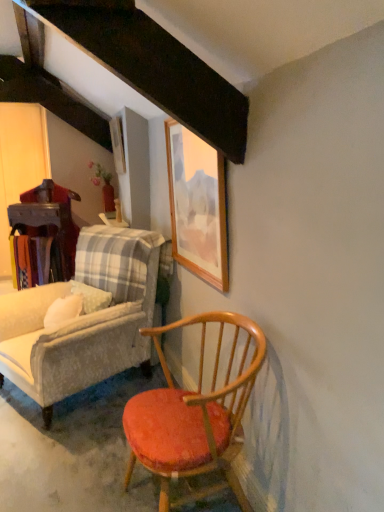
I want to click on wooden picture frame at upper center, which appears as the 1th picture frame when viewed from the right, so click(x=197, y=205).

In order to click on wooden chair with cushion at lower left, the second chair viewed from the right in this screenshot , I will do `click(83, 319)`.

Describe the element at coordinates (41, 218) in the screenshot. I see `wooden table at left` at that location.

The height and width of the screenshot is (512, 384). Describe the element at coordinates (117, 144) in the screenshot. I see `wooden picture frame at upper center, positioned as the 2th picture frame in bottom-to-top order` at that location.

The height and width of the screenshot is (512, 384). What are the coordinates of `wooden chair with orange cushion at lower right, the second chair positioned from the left` in the screenshot? It's located at (194, 415).

How much space does wooden chair with orange cushion at lower right, arranged as the first chair when viewed from the right, occupy vertically?

30.11 inches.

Locate an element on the screen. The image size is (384, 512). wooden picture frame at upper center, which appears as the 1th picture frame when viewed from the right is located at coordinates (197, 205).

How distant is wooden chair with cushion at lower left, the first chair in the back-to-front sequence, from wooden picture frame at upper center, positioned as the 2th picture frame in bottom-to-top order?

wooden chair with cushion at lower left, the first chair in the back-to-front sequence, and wooden picture frame at upper center, positioned as the 2th picture frame in bottom-to-top order, are 4.34 feet apart from each other.

Considering the sizes of objects wooden chair with cushion at lower left, the second chair viewed from the right, and wooden picture frame at upper center, arranged as the first picture frame when viewed from the top, in the image provided, who is bigger, wooden chair with cushion at lower left, the second chair viewed from the right, or wooden picture frame at upper center, arranged as the first picture frame when viewed from the top,?

A: wooden chair with cushion at lower left, the second chair viewed from the right, is bigger.

Would you say wooden chair with cushion at lower left, the second chair viewed from the right, contains wooden picture frame at upper center, arranged as the first picture frame when viewed from the top?

Definitely not — wooden picture frame at upper center, arranged as the first picture frame when viewed from the top, is not inside wooden chair with cushion at lower left, the second chair viewed from the right.

Which is in front, point (186, 229) or point (149, 260)?

The point (186, 229) is in front.

From the image's perspective, is wooden picture frame at upper center, the second picture frame positioned from the left, positioned above or below wooden chair with cushion at lower left, the second chair viewed from the right?

Based on their image positions, wooden picture frame at upper center, the second picture frame positioned from the left, is located above wooden chair with cushion at lower left, the second chair viewed from the right.

Is wooden picture frame at upper center, which is counted as the second picture frame, starting from the top, facing towards wooden chair with cushion at lower left, placed as the second chair when sorted from front to back?

No, wooden picture frame at upper center, which is counted as the second picture frame, starting from the top, is not oriented towards wooden chair with cushion at lower left, placed as the second chair when sorted from front to back.

Considering the relative sizes of wooden picture frame at upper center, which appears as the 2th picture frame when viewed from the right, and wooden chair with orange cushion at lower right, the second chair positioned from the left, in the image provided, is wooden picture frame at upper center, which appears as the 2th picture frame when viewed from the right, shorter than wooden chair with orange cushion at lower right, the second chair positioned from the left,?

Yes, wooden picture frame at upper center, which appears as the 2th picture frame when viewed from the right, is shorter than wooden chair with orange cushion at lower right, the second chair positioned from the left.

Can you tell me how much wooden picture frame at upper center, which ranks as the first picture frame in back-to-front order, and wooden chair with orange cushion at lower right, arranged as the first chair when viewed from the front, differ in facing direction?

0.000812 degrees separate the facing orientations of wooden picture frame at upper center, which ranks as the first picture frame in back-to-front order, and wooden chair with orange cushion at lower right, arranged as the first chair when viewed from the front.

Choose the correct answer: Is wooden picture frame at upper center, which ranks as the first picture frame in back-to-front order, inside wooden chair with orange cushion at lower right, the second chair from the back, or outside it?

wooden picture frame at upper center, which ranks as the first picture frame in back-to-front order, is not enclosed by wooden chair with orange cushion at lower right, the second chair from the back.

Considering the relative sizes of wooden picture frame at upper center, arranged as the first picture frame when viewed from the top, and wooden chair with orange cushion at lower right, arranged as the first chair when viewed from the front, in the image provided, is wooden picture frame at upper center, arranged as the first picture frame when viewed from the top, bigger than wooden chair with orange cushion at lower right, arranged as the first chair when viewed from the front,?

No.

Is wooden chair with orange cushion at lower right, arranged as the first chair when viewed from the right, at the right side of wooden picture frame at upper center, which ranks as the first picture frame in back-to-front order?

Correct, you'll find wooden chair with orange cushion at lower right, arranged as the first chair when viewed from the right, to the right of wooden picture frame at upper center, which ranks as the first picture frame in back-to-front order.

Which picture frame is the 2nd one when counting from the back of the wooden chair with orange cushion at lower right, the second chair positioned from the left? Please provide its 2D coordinates.

[(117, 144)]

Can you tell me how much wooden chair with orange cushion at lower right, arranged as the first chair when viewed from the right, and wooden picture frame at upper center, arranged as the first picture frame when viewed from the top, differ in facing direction?

They differ by 0.000812 degrees in their facing directions.

From the image's perspective, which one is positioned higher, wooden chair with orange cushion at lower right, the second chair positioned from the left, or wooden picture frame at upper center, arranged as the first picture frame when viewed from the top?

wooden picture frame at upper center, arranged as the first picture frame when viewed from the top, from the image's perspective.

From a real-world perspective, is wooden picture frame at upper center, positioned as the 2th picture frame in bottom-to-top order, located higher than wooden picture frame at upper center, the second picture frame positioned from the left?

Indeed, from a real-world perspective, wooden picture frame at upper center, positioned as the 2th picture frame in bottom-to-top order, stands above wooden picture frame at upper center, the second picture frame positioned from the left.

Is wooden picture frame at upper center, acting as the 2th picture frame starting from the front, inside or outside of wooden picture frame at upper center, which appears as the 1th picture frame when viewed from the right?

wooden picture frame at upper center, acting as the 2th picture frame starting from the front, exists outside the volume of wooden picture frame at upper center, which appears as the 1th picture frame when viewed from the right.

Is wooden picture frame at upper center, marked as the first picture frame in a left-to-right arrangement, smaller than wooden picture frame at upper center, which is the 1th picture frame in bottom-to-top order?

Indeed, wooden picture frame at upper center, marked as the first picture frame in a left-to-right arrangement, has a smaller size compared to wooden picture frame at upper center, which is the 1th picture frame in bottom-to-top order.

Is wooden picture frame at upper center, the second picture frame positioned from the left, not inside wooden chair with orange cushion at lower right, arranged as the first chair when viewed from the front?

Indeed, wooden picture frame at upper center, the second picture frame positioned from the left, is completely outside wooden chair with orange cushion at lower right, arranged as the first chair when viewed from the front.

Considering the sizes of wooden picture frame at upper center, which is counted as the second picture frame, starting from the top, and wooden chair with orange cushion at lower right, the second chair from the back, in the image, is wooden picture frame at upper center, which is counted as the second picture frame, starting from the top, taller or shorter than wooden chair with orange cushion at lower right, the second chair from the back,?

wooden picture frame at upper center, which is counted as the second picture frame, starting from the top, is taller than wooden chair with orange cushion at lower right, the second chair from the back.

Do you think wooden chair with orange cushion at lower right, arranged as the first chair when viewed from the front, is within wooden picture frame at upper center, which ranks as the 2th picture frame in back-to-front order, or outside of it?

The correct answer is: outside.

How far apart are wooden chair with orange cushion at lower right, arranged as the first chair when viewed from the right, and wooden picture frame at upper center, which is the 1th picture frame in bottom-to-top order?

They are 23.62 inches apart.

Which is farther, (178, 418) or (189, 162)?

The point (189, 162) is behind.

Which object is closer to the camera taking this photo, wooden chair with orange cushion at lower right, the second chair from the back, or wooden picture frame at upper center, the second picture frame positioned from the left?

Positioned in front is wooden chair with orange cushion at lower right, the second chair from the back.

The height and width of the screenshot is (512, 384). I want to click on chair that is the 1st one below the wooden picture frame at upper center, arranged as the first picture frame when viewed from the top (from a real-world perspective), so click(83, 319).

From the image's perspective, which chair is the 1st one below the wooden picture frame at upper center, which is the 1th picture frame in bottom-to-top order? Please provide its 2D coordinates.

[(83, 319)]

When comparing their distances from wooden table at left, does wooden picture frame at upper center, which appears as the 1th picture frame when viewed from the right, or wooden chair with cushion at lower left, the 1th chair in the left-to-right sequence, seem closer?

wooden chair with cushion at lower left, the 1th chair in the left-to-right sequence, is closer to wooden table at left.

Considering their positions, is wooden picture frame at upper center, acting as the 2th picture frame starting from the front, positioned further to wooden picture frame at upper center, which is counted as the second picture frame, starting from the top, than wooden table at left?

Based on the image, wooden table at left appears to be further to wooden picture frame at upper center, which is counted as the second picture frame, starting from the top.

Considering their positions, is wooden picture frame at upper center, the second picture frame positioned from the left, positioned closer to wooden table at left than wooden chair with orange cushion at lower right, the second chair positioned from the left?

wooden picture frame at upper center, the second picture frame positioned from the left, is positioned closer to the anchor wooden table at left.

When comparing their distances from wooden chair with orange cushion at lower right, arranged as the first chair when viewed from the right, does wooden table at left or wooden picture frame at upper center, the first picture frame positioned from the front, seem closer?

Based on the image, wooden picture frame at upper center, the first picture frame positioned from the front, appears to be nearer to wooden chair with orange cushion at lower right, arranged as the first chair when viewed from the right.

Estimate the real-world distances between objects in this image. Which object is closer to wooden picture frame at upper center, arranged as the first picture frame when viewed from the top, wooden chair with cushion at lower left, the first chair in the back-to-front sequence, or wooden table at left?

Based on the image, wooden table at left appears to be nearer to wooden picture frame at upper center, arranged as the first picture frame when viewed from the top.

From the image, which object appears to be farther from wooden picture frame at upper center, the first picture frame positioned from the front, wooden chair with orange cushion at lower right, the second chair positioned from the left, or wooden table at left?

wooden table at left is further to wooden picture frame at upper center, the first picture frame positioned from the front.

Which object lies further to the anchor point wooden chair with cushion at lower left, the 1th chair in the left-to-right sequence, wooden picture frame at upper center, positioned as the 2th picture frame in bottom-to-top order, or wooden table at left?

The object further to wooden chair with cushion at lower left, the 1th chair in the left-to-right sequence, is wooden picture frame at upper center, positioned as the 2th picture frame in bottom-to-top order.

From the image, which object appears to be farther from wooden picture frame at upper center, arranged as the first picture frame when viewed from the top, wooden picture frame at upper center, the first picture frame positioned from the front, or wooden table at left?

wooden picture frame at upper center, the first picture frame positioned from the front, lies further to wooden picture frame at upper center, arranged as the first picture frame when viewed from the top, than the other object.

Find the location of a particular element. This screenshot has height=512, width=384. chair between wooden picture frame at upper center, which ranks as the 2th picture frame in back-to-front order, and wooden picture frame at upper center, positioned as the 2th picture frame in bottom-to-top order, in the front-back direction is located at coordinates (83, 319).

Image resolution: width=384 pixels, height=512 pixels. In order to click on picture frame positioned between wooden picture frame at upper center, which is the 1th picture frame in bottom-to-top order, and wooden table at left from near to far in this screenshot , I will do `click(117, 144)`.

Find the location of a particular element. The image size is (384, 512). chair between wooden picture frame at upper center, which is counted as the second picture frame, starting from the top, and wooden table at left, along the z-axis is located at coordinates (83, 319).

Locate an element on the screen. This screenshot has width=384, height=512. picture frame between wooden chair with cushion at lower left, the first chair in the back-to-front sequence, and wooden table at left in the front-back direction is located at coordinates (117, 144).